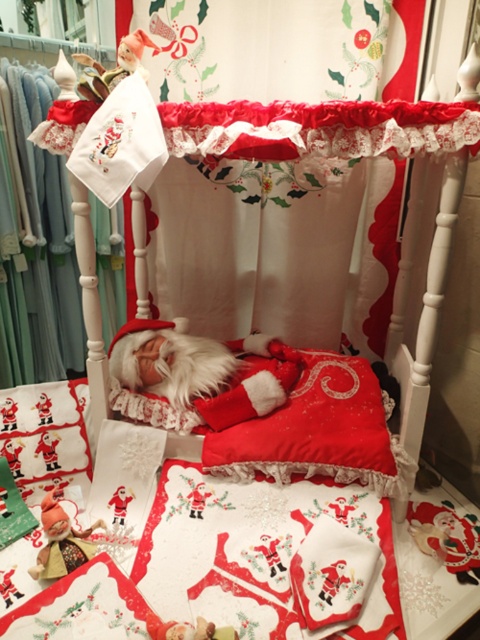
In the scene shown: Does matte red elf at lower left have a lesser height compared to matte plastic doll at upper left?

Yes, matte red elf at lower left is shorter than matte plastic doll at upper left.

Can you confirm if matte red elf at lower left is positioned to the left of matte plastic doll at upper left?

Yes, matte red elf at lower left is to the left of matte plastic doll at upper left.

The height and width of the screenshot is (640, 480). I want to click on matte red elf at lower left, so (61, 541).

Is white lace curtain at upper center to the left of velvet santa at center from the viewer's perspective?

In fact, white lace curtain at upper center is to the right of velvet santa at center.

Who is more forward, (377, 224) or (199, 632)?

Point (199, 632)

Between point (119, 22) and point (202, 618), which one is positioned in front?

Point (202, 618) is more forward.

You are a GUI agent. You are given a task and a screenshot of the screen. Output one action in this format:
    pyautogui.click(x=<x>, y=<y>)
    Task: Click on the white lace curtain at upper center
    Image resolution: width=480 pixels, height=640 pixels.
    Given the screenshot: What is the action you would take?
    pyautogui.click(x=407, y=51)

Can you confirm if red velvet pillow at center is positioned above white lace curtain at upper center?

Incorrect, red velvet pillow at center is not positioned above white lace curtain at upper center.

Which is behind, point (208, 435) or point (400, 0)?

Positioned behind is point (400, 0).

Where is `red velvet pillow at center`? red velvet pillow at center is located at coordinates (316, 429).